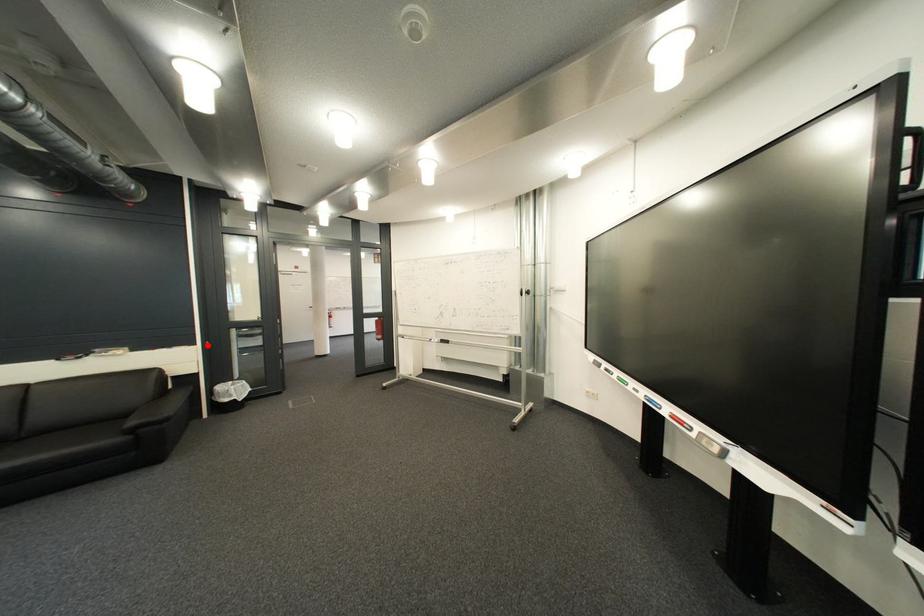
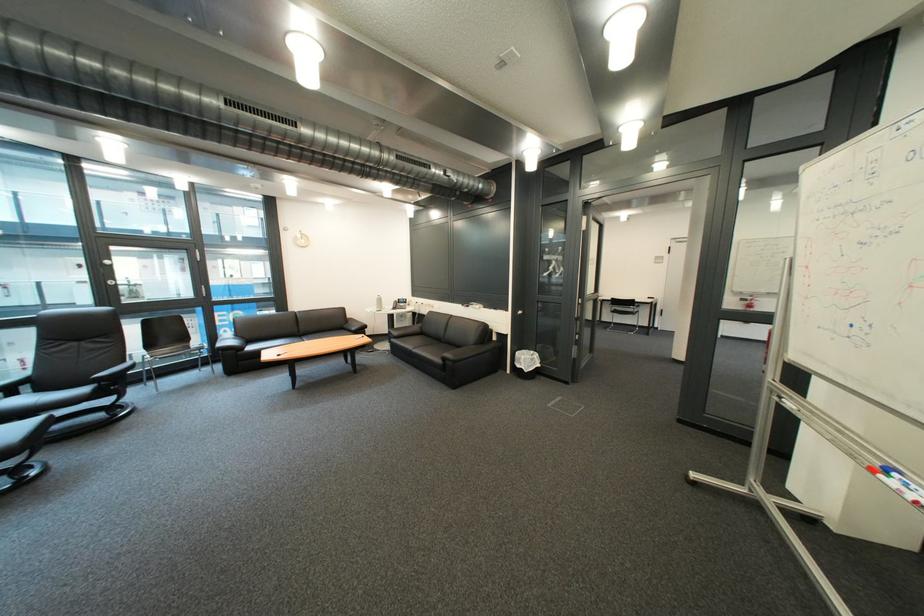
Question: I am providing you with two images of the same scene from different viewpoints. Image1 has a red point marked. In image2, the corresponding 3D location appears at what relative position? Reply with the corresponding letter.

Choices:
 (A) Closer
 (B) Farther

Answer: (B)